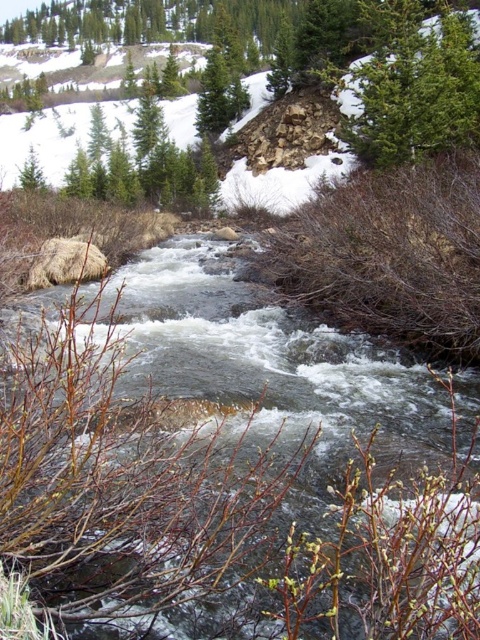
Question: Does clear water at center come in front of green textured evergreen tree at upper center?

Choices:
 (A) no
 (B) yes

Answer: (B)

Question: Is clear water at center smaller than green textured evergreen tree at upper center?

Choices:
 (A) no
 (B) yes

Answer: (B)

Question: Which of the following is the farthest from the observer?

Choices:
 (A) (305, 365)
 (B) (374, 77)

Answer: (B)

Question: Can you confirm if clear water at center is smaller than green textured evergreen tree at upper center?

Choices:
 (A) yes
 (B) no

Answer: (A)

Question: Which point is farther to the camera?

Choices:
 (A) clear water at center
 (B) green textured evergreen tree at upper center

Answer: (B)

Question: Among these objects, which one is nearest to the camera?

Choices:
 (A) clear water at center
 (B) green textured evergreen tree at upper center

Answer: (A)